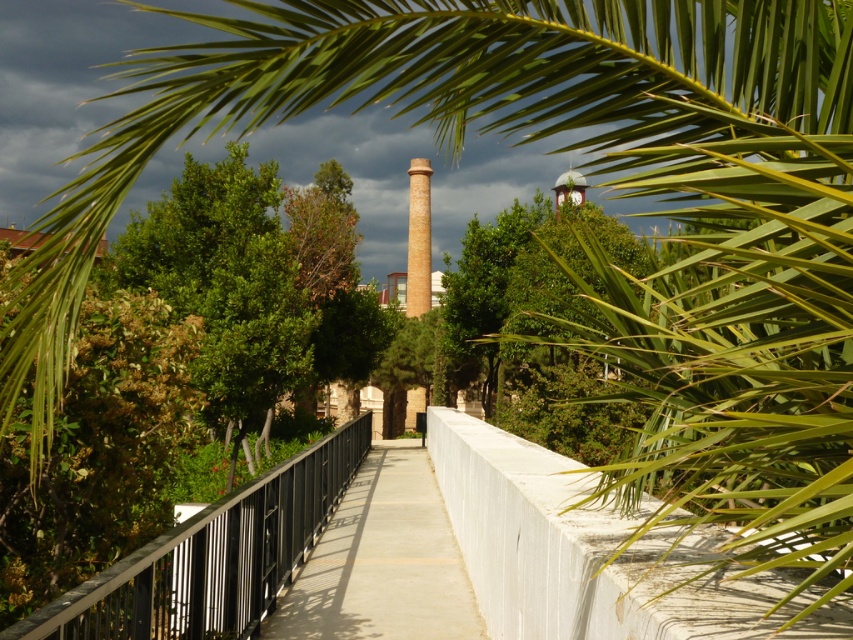
Can you confirm if black metal railing at center is smaller than concrete sidewalk at center?

Yes, black metal railing at center is smaller than concrete sidewalk at center.

From the picture: Which of these two, black metal railing at center or concrete sidewalk at center, stands taller?

black metal railing at center

Image resolution: width=853 pixels, height=640 pixels. What do you see at coordinates (213, 556) in the screenshot?
I see `black metal railing at center` at bounding box center [213, 556].

Where is `black metal railing at center`? The height and width of the screenshot is (640, 853). black metal railing at center is located at coordinates (213, 556).